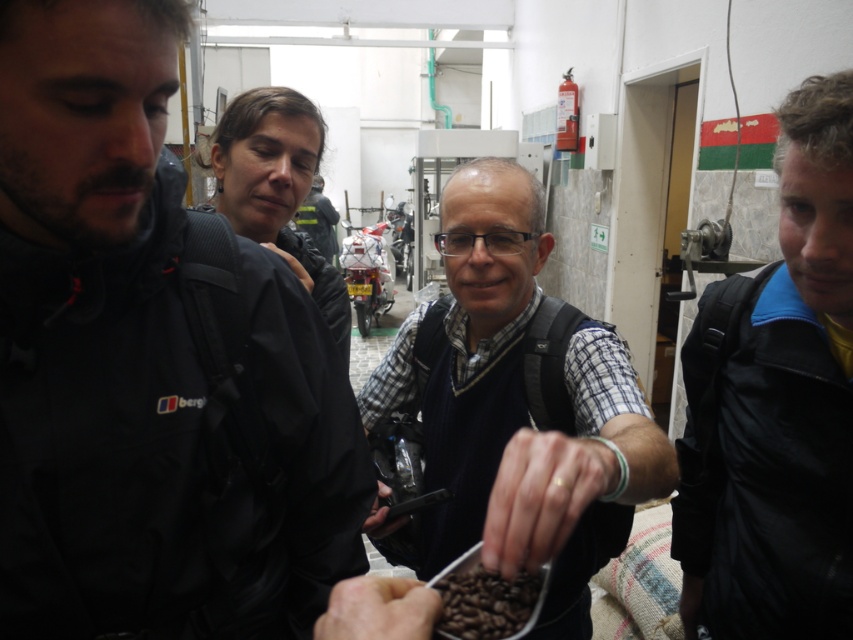
Question: Which of the following is the closest to the observer?

Choices:
 (A) (828, 337)
 (B) (497, 589)
 (C) (341, 420)
 (D) (471, 336)

Answer: (B)

Question: In this image, where is black leather jacket at right located relative to brown matte coffee beans at center?

Choices:
 (A) right
 (B) left

Answer: (A)

Question: Which of these objects is positioned farthest from the black leather jacket at right?

Choices:
 (A) matte black jacket at left
 (B) checkered fabric shirt at center

Answer: (A)

Question: Does black leather jacket at right have a smaller size compared to brown matte coffee beans at center?

Choices:
 (A) no
 (B) yes

Answer: (A)

Question: Which of the following is the closest to the observer?

Choices:
 (A) matte black jacket at left
 (B) black leather jacket at right
 (C) brown matte coffee beans at center

Answer: (A)

Question: Is black leather jacket at right to the left of brown matte coffee beans at center from the viewer's perspective?

Choices:
 (A) yes
 (B) no

Answer: (B)